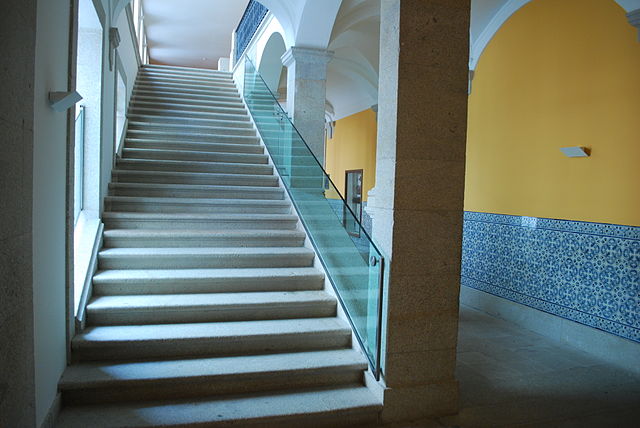
The height and width of the screenshot is (428, 640). What are the coordinates of `rectangular light` in the screenshot? It's located at (575, 153), (64, 102).